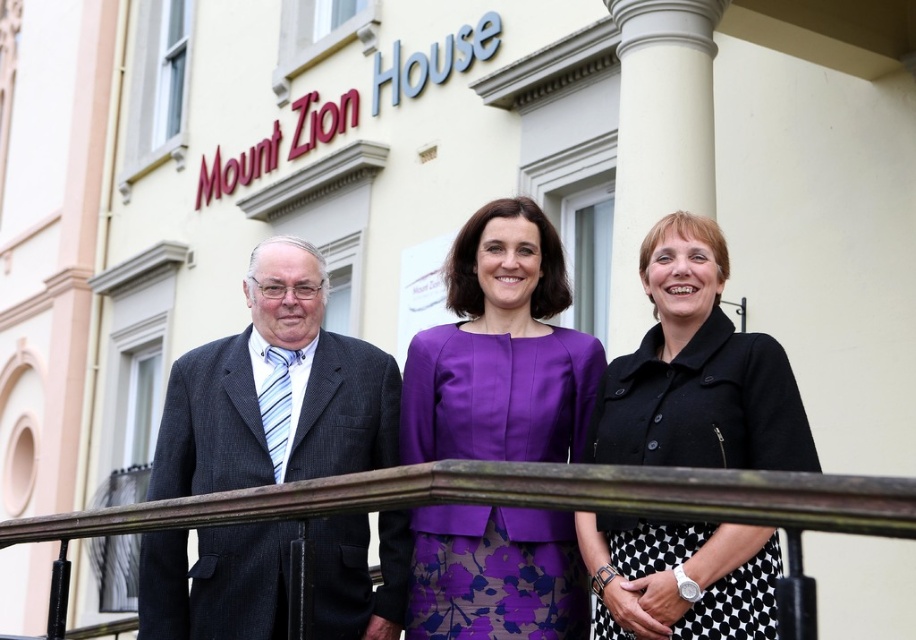
You are a maintenance worker needing to inspect both the brown wooden rail at center and the white smooth column at center. Given that you can only carry tools for one object at a time, which object should you inspect first if you want to minimize the distance you walk?

You should inspect the brown wooden rail at center first because it is closer to your starting position than the white smooth column at center, as the distance between them is 13.01 meters.

You are an architect reviewing the design of Mount Zion House. You notice the black matte jacket at center and the white smooth column at center. Which object takes up more space in the design?

The black matte jacket at center is bigger than the white smooth column at center, so it takes up more space in the design.